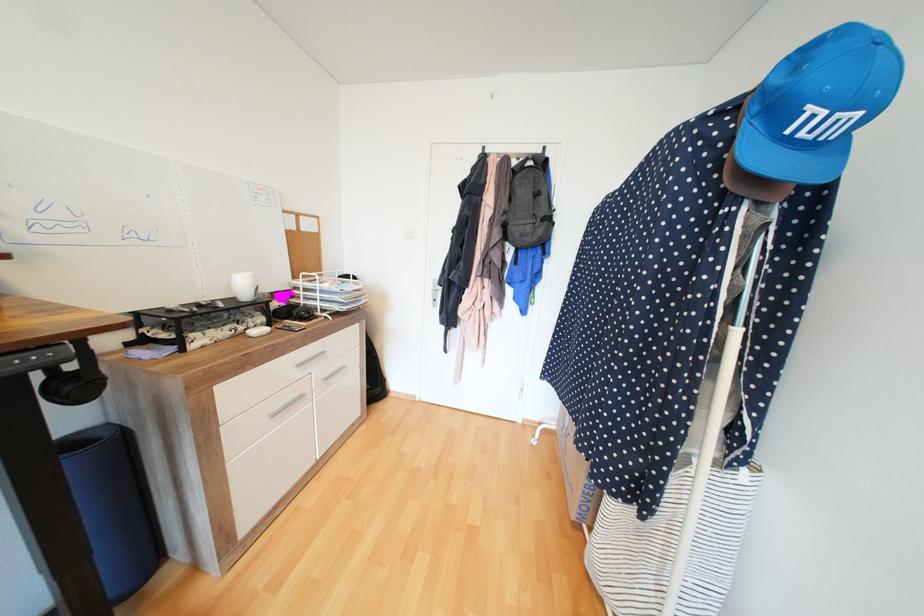
This screenshot has width=924, height=616. Find the location of `black headphones`. black headphones is located at coordinates (74, 379).